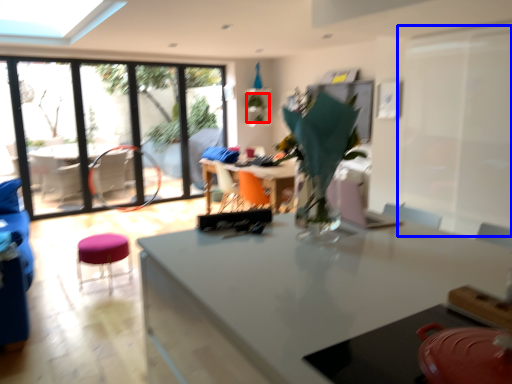
Question: Which of the following is the closest to the observer, plant (highlighted by a red box) or screen door (highlighted by a blue box)?

Choices:
 (A) plant
 (B) screen door

Answer: (B)